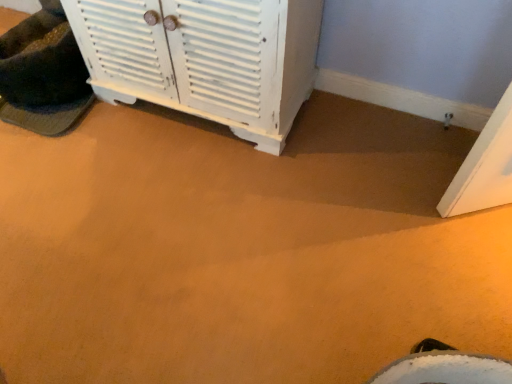
What do you see at coordinates (205, 58) in the screenshot?
I see `white painted wood cabinet at center` at bounding box center [205, 58].

Image resolution: width=512 pixels, height=384 pixels. Find the location of `white painted wood cabinet at center`. white painted wood cabinet at center is located at coordinates point(205,58).

You are a GUI agent. You are given a task and a screenshot of the screen. Output one action in this format:
    pyautogui.click(x=<x>, y=<y>)
    Task: Click on the white painted wood cabinet at center
    
    Given the screenshot: What is the action you would take?
    pyautogui.click(x=205, y=58)